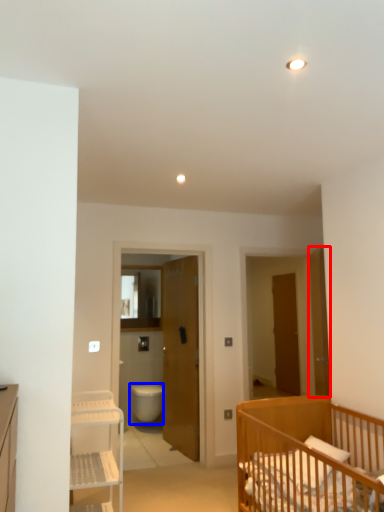
Question: Among these objects, which one is nearest to the camera, door (highlighted by a red box) or toilet bowl (highlighted by a blue box)?

Choices:
 (A) door
 (B) toilet bowl

Answer: (A)